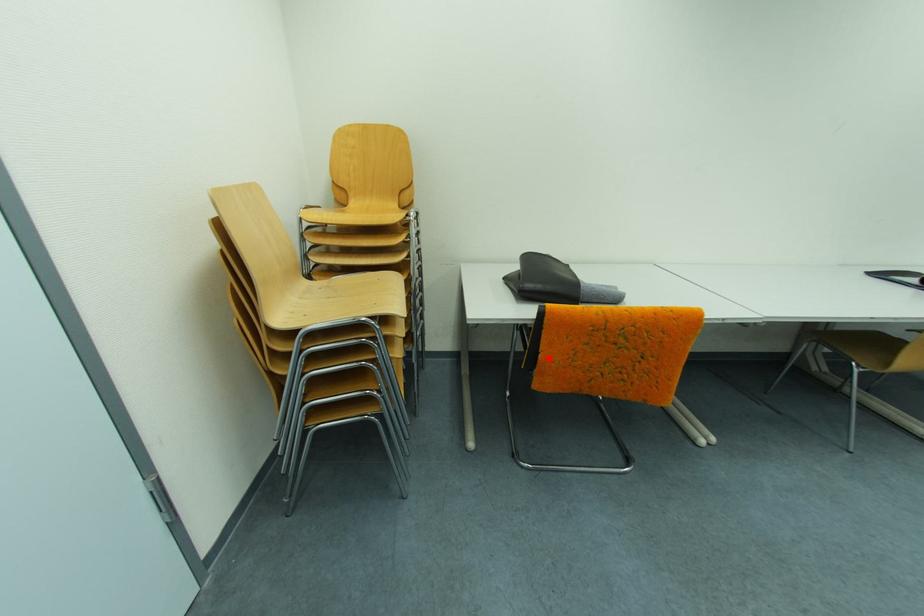
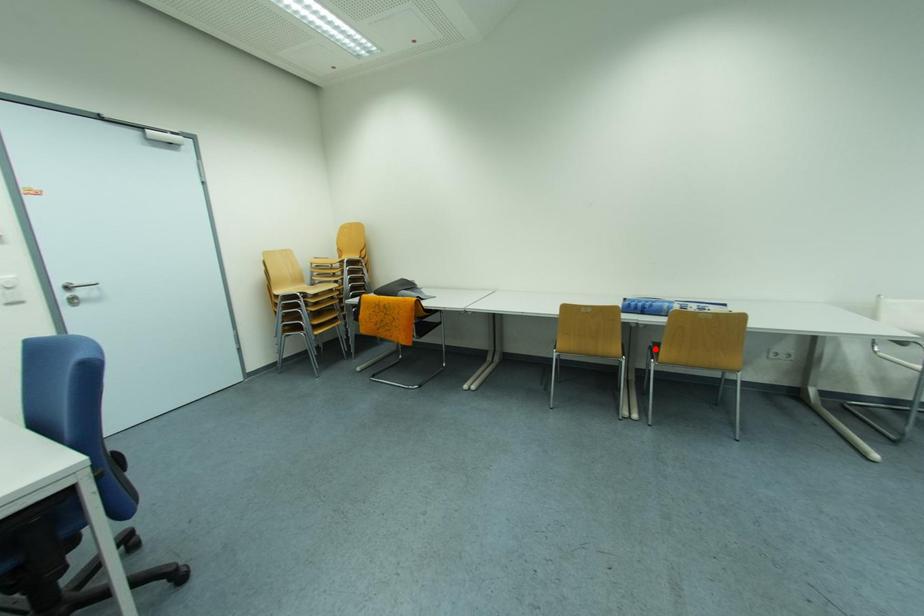
I am providing you with two images of the same scene from different viewpoints. A red point is marked on the first image and another point is marked on the second image. Is the red point in image1 aligned with the point shown in image2?

No